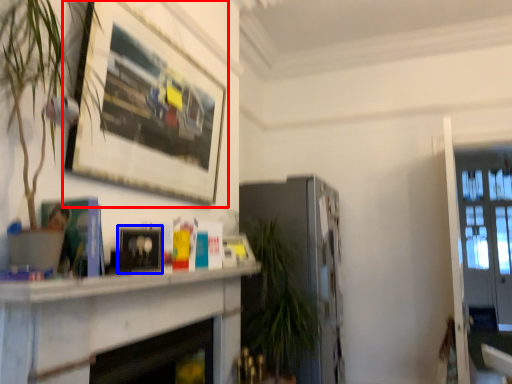
Question: Which object is closer to the camera taking this photo, picture frame (highlighted by a red box) or picture frame (highlighted by a blue box)?

Choices:
 (A) picture frame
 (B) picture frame

Answer: (A)